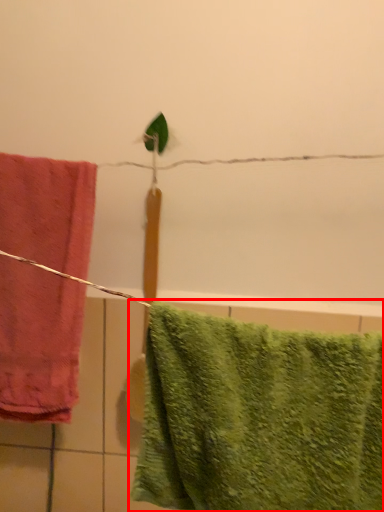
Question: From the image's perspective, what is the correct spatial positioning of towel (annotated by the red box) in reference to towel?

Choices:
 (A) above
 (B) below

Answer: (B)